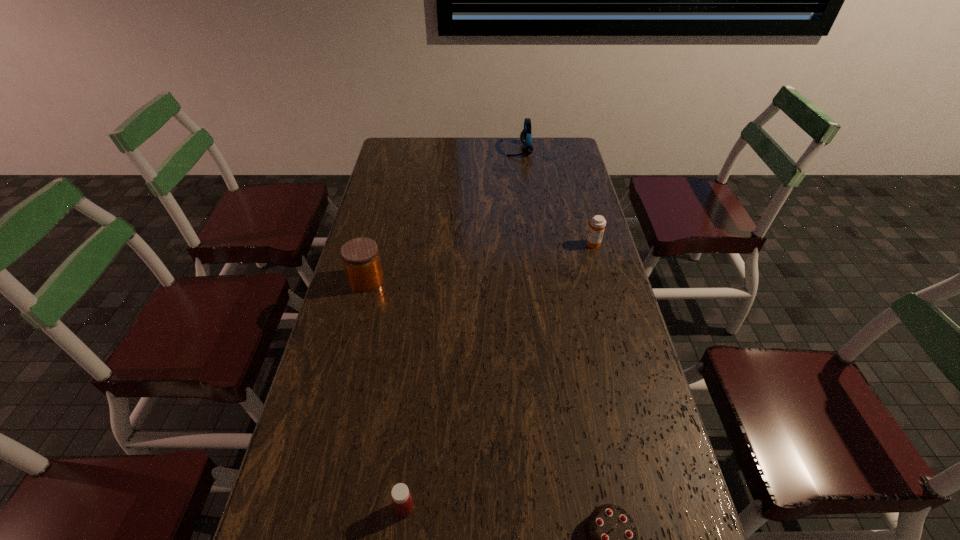
In order to click on free space between the third farthest object and the nearer medicine in this screenshot , I will do `click(386, 394)`.

You are a GUI agent. You are given a task and a screenshot of the screen. Output one action in this format:
    pyautogui.click(x=<x>, y=<y>)
    Task: Click on the free space that is in between the jar and the headset
    This screenshot has width=960, height=540.
    Given the screenshot: What is the action you would take?
    pyautogui.click(x=443, y=215)

Locate an element on the screen. This screenshot has height=540, width=960. free spot between the farthest object and the third nearest object is located at coordinates (443, 215).

Image resolution: width=960 pixels, height=540 pixels. Find the location of `free space between the farther medicine and the fourth tallest object`. free space between the farther medicine and the fourth tallest object is located at coordinates (499, 376).

The height and width of the screenshot is (540, 960). I want to click on free space between the second farthest object and the nearer medicine, so click(499, 376).

Where is `free space that is in between the jar and the nearer medicine`? This screenshot has width=960, height=540. free space that is in between the jar and the nearer medicine is located at coordinates (386, 394).

Locate an element on the screen. The height and width of the screenshot is (540, 960). empty location between the headset and the leftmost object is located at coordinates (443, 215).

What are the coordinates of `free area in between the jar and the farther medicine` in the screenshot? It's located at (479, 262).

At what (x,y) coordinates should I click in order to perform the action: click on object that is the second closest to the leftmost object. Please return your answer as a coordinate pair (x, y). Image resolution: width=960 pixels, height=540 pixels. Looking at the image, I should click on (597, 224).

Locate an element on the screen. Image resolution: width=960 pixels, height=540 pixels. object that stands as the fourth closest to the jar is located at coordinates (612, 537).